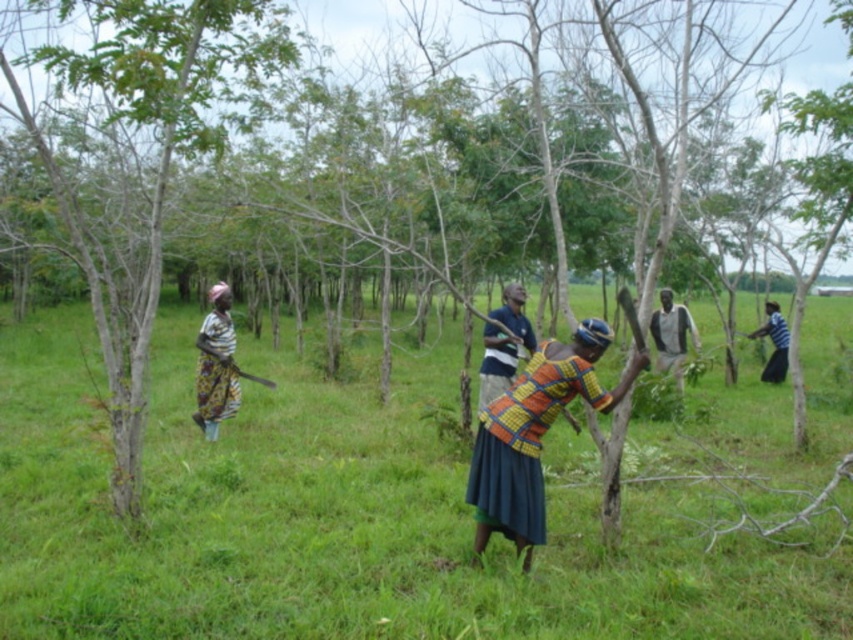
You are organizing a group photo and need to arrange the blue fabric shirt at center and dark gray fabric shirt at center side by side. Based on their widths, which one should be placed on the left to ensure they fit within the frame without overlapping?

The blue fabric shirt at center has a lesser width compared to dark gray fabric shirt at center. Therefore, placing the blue fabric shirt at center on the left and the dark gray fabric shirt at center on the right will ensure they fit within the frame without overlapping since the wider shirt requires more space.

You are a hiker who wants to step onto the multicolored woven cloth at center. Based on the scene description, will the green grass at center interfere with your ability to step onto the cloth?

The green grass at center is taller than the multicolored woven cloth at center, so stepping onto the cloth might be difficult due to the grass obstructing the path.

You are a photographer standing in the scene and want to take a photo of the multicolored woven cloth at center without the green grass at center appearing in the foreground. Is this possible?

The green grass at center is closer to the viewer than the multicolored woven cloth at center, so the grass will appear in front of the cloth in the photo. To avoid the grass in the foreground, you would need to adjust your position or angle to ensure the cloth is not obscured.